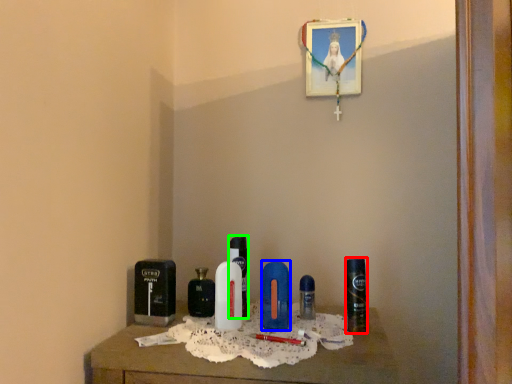
Question: Which is nearer to the personal care (highlighted by a red box)? personal care (highlighted by a blue box) or perfume (highlighted by a green box).

Choices:
 (A) personal care
 (B) perfume

Answer: (A)